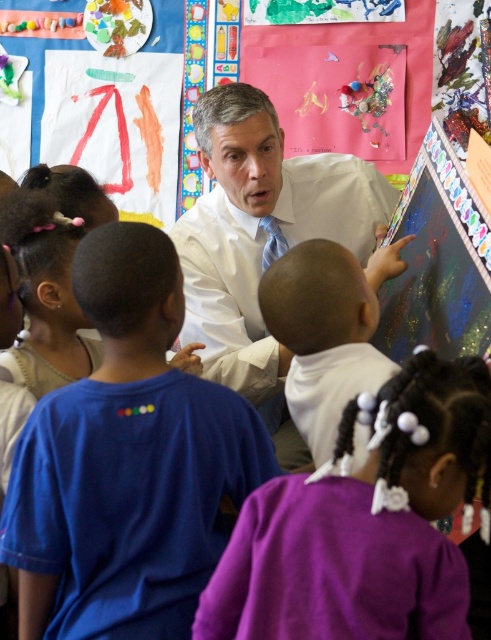
Question: Which of the following is the farthest from the observer?

Choices:
 (A) (314, 301)
 (B) (192, 573)
 (C) (409, 380)
 (D) (240, 273)

Answer: (D)

Question: Is white smooth shirt at center above white matte shirt at center?

Choices:
 (A) yes
 (B) no

Answer: (A)

Question: Does purple fabric at lower center have a lesser width compared to white smooth shirt at center?

Choices:
 (A) yes
 (B) no

Answer: (A)

Question: Considering the real-world distances, which object is farthest from the blue cotton shirt at center?

Choices:
 (A) white matte shirt at center
 (B) white smooth shirt at center

Answer: (B)

Question: Which object appears farthest from the camera in this image?

Choices:
 (A) white matte shirt at center
 (B) blue cotton shirt at center
 (C) white smooth shirt at center

Answer: (C)

Question: Is blue cotton shirt at center smaller than white matte shirt at center?

Choices:
 (A) no
 (B) yes

Answer: (A)